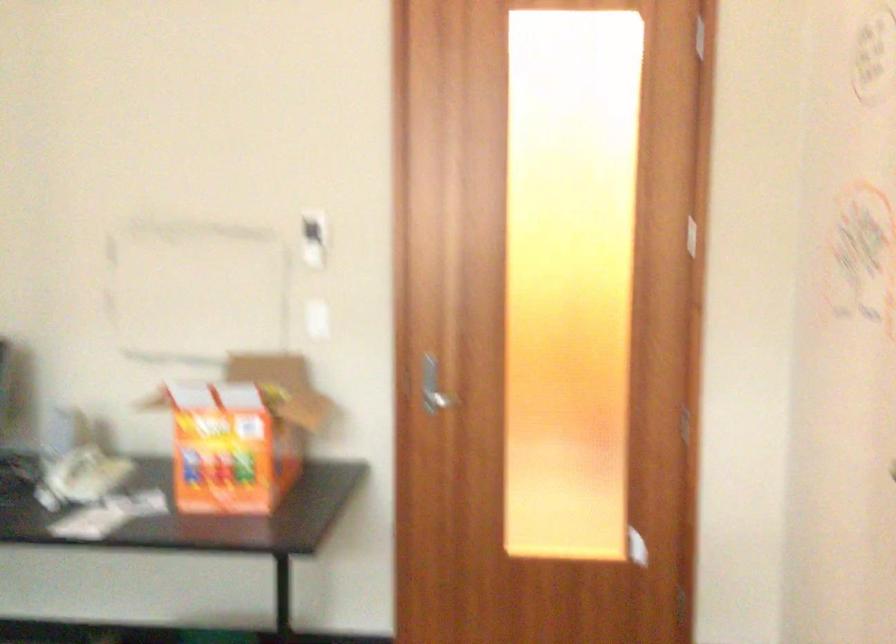
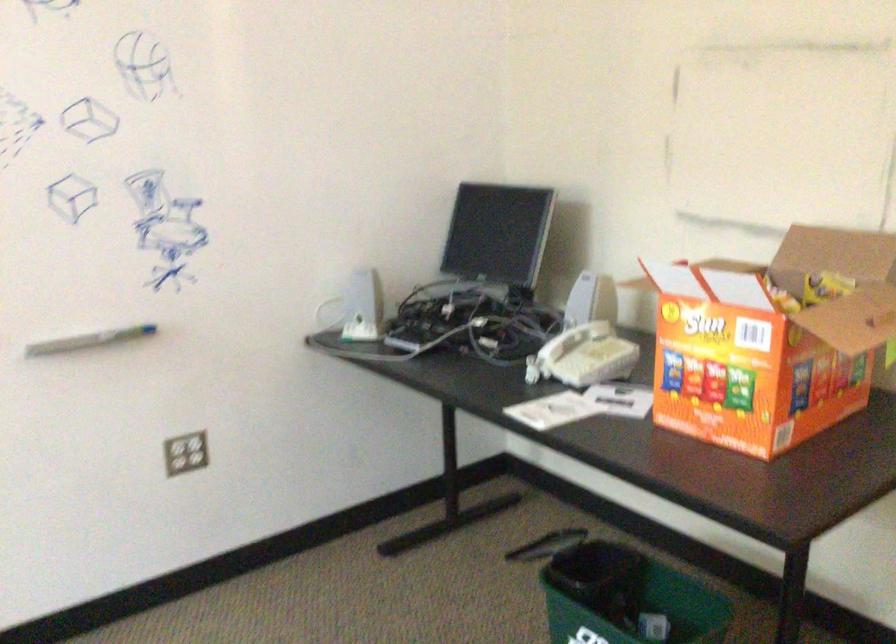
Where in the second image is the point corresponding to (271,395) from the first image?

(824, 287)